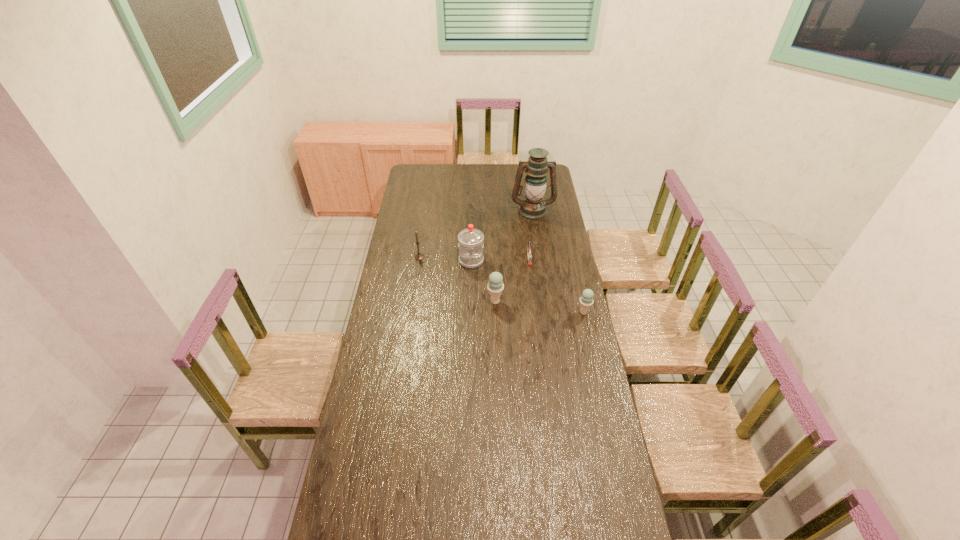
Image resolution: width=960 pixels, height=540 pixels. Find the location of `the taller ice cream`. the taller ice cream is located at coordinates (495, 286).

Find the location of a particular element. The width and height of the screenshot is (960, 540). the second nearest object is located at coordinates (495, 286).

Where is `the shorter ice cream`? This screenshot has height=540, width=960. the shorter ice cream is located at coordinates (586, 300).

Locate an element on the screen. The image size is (960, 540). the nearer ice cream is located at coordinates (586, 300).

At what (x,y) coordinates should I click in order to perform the action: click on candle. Please return your answer as a coordinate pair (x, y). Looking at the image, I should click on (419, 256).

The width and height of the screenshot is (960, 540). What are the coordinates of `the farthest object` in the screenshot? It's located at (533, 207).

What are the coordinates of `the tallest object` in the screenshot? It's located at 533,207.

Where is `the shortest object`? The height and width of the screenshot is (540, 960). the shortest object is located at coordinates (529, 255).

Image resolution: width=960 pixels, height=540 pixels. In order to click on the fifth shortest object in this screenshot , I will do `click(470, 245)`.

The height and width of the screenshot is (540, 960). I want to click on water bottle, so click(470, 245).